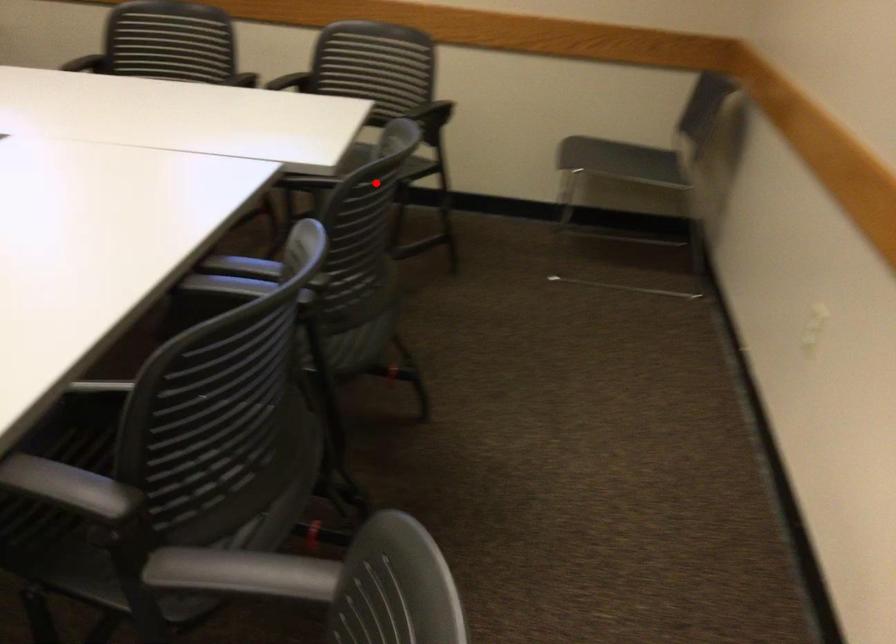
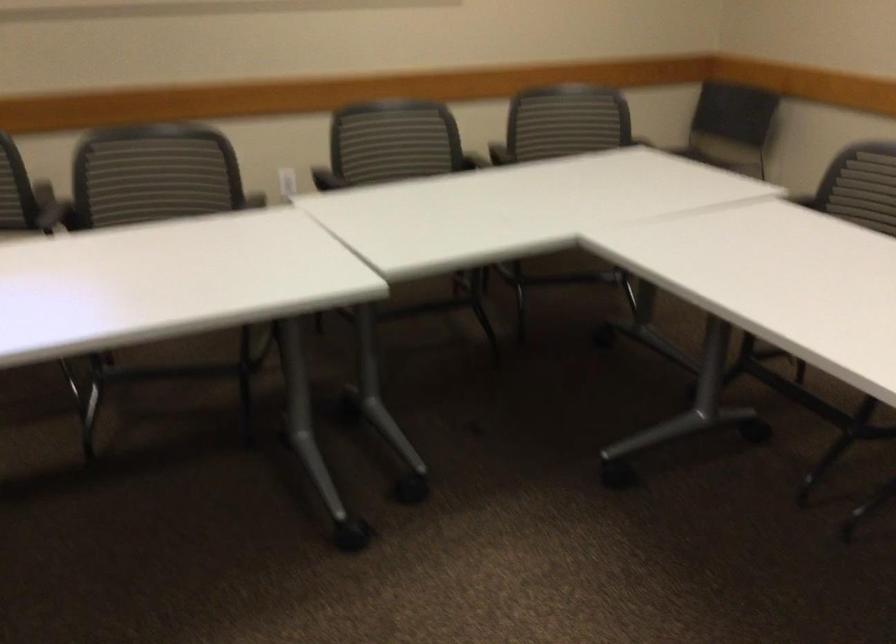
The point at the highlighted location is marked in the first image. Where is the corresponding point in the second image?

(866, 185)